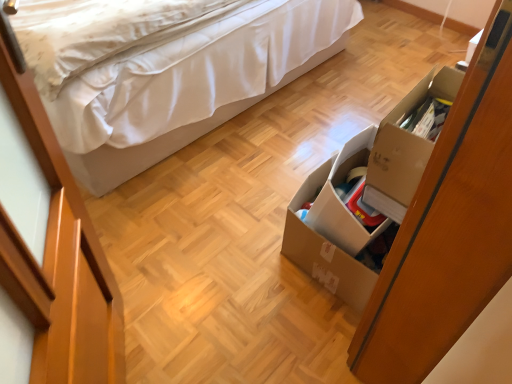
Question: From a real-world perspective, is brown cardboard box at lower right located higher than white fabric bed at upper left?

Choices:
 (A) no
 (B) yes

Answer: (A)

Question: Does brown cardboard box at lower right have a smaller size compared to white fabric bed at upper left?

Choices:
 (A) yes
 (B) no

Answer: (A)

Question: From a real-world perspective, is brown cardboard box at lower right beneath white fabric bed at upper left?

Choices:
 (A) no
 (B) yes

Answer: (B)

Question: Considering the relative sizes of brown cardboard box at lower right and white fabric bed at upper left in the image provided, is brown cardboard box at lower right taller than white fabric bed at upper left?

Choices:
 (A) no
 (B) yes

Answer: (A)

Question: From the image's perspective, would you say brown cardboard box at lower right is positioned over white fabric bed at upper left?

Choices:
 (A) yes
 (B) no

Answer: (B)

Question: From the image's perspective, would you say brown cardboard box at lower right is shown under white fabric bed at upper left?

Choices:
 (A) yes
 (B) no

Answer: (A)

Question: Considering the relative sizes of cardboard box at right and white fabric bed at upper left in the image provided, is cardboard box at right thinner than white fabric bed at upper left?

Choices:
 (A) no
 (B) yes

Answer: (B)

Question: Is cardboard box at right positioned before white fabric bed at upper left?

Choices:
 (A) yes
 (B) no

Answer: (A)

Question: From the image's perspective, is cardboard box at right below white fabric bed at upper left?

Choices:
 (A) yes
 (B) no

Answer: (A)

Question: Considering the relative sizes of cardboard box at right and white fabric bed at upper left in the image provided, is cardboard box at right wider than white fabric bed at upper left?

Choices:
 (A) yes
 (B) no

Answer: (B)

Question: Is cardboard box at right touching white fabric bed at upper left?

Choices:
 (A) yes
 (B) no

Answer: (B)

Question: Considering the relative sizes of cardboard box at right and white fabric bed at upper left in the image provided, is cardboard box at right taller than white fabric bed at upper left?

Choices:
 (A) yes
 (B) no

Answer: (B)

Question: Is white fabric bed at upper left wider than brown cardboard box at lower right?

Choices:
 (A) yes
 (B) no

Answer: (A)